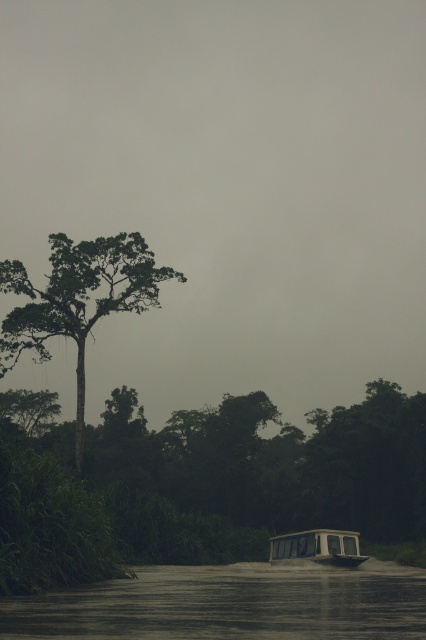
Question: Considering the relative positions of dark water at lower center and white plastic boat at lower center in the image provided, where is dark water at lower center located with respect to white plastic boat at lower center?

Choices:
 (A) above
 (B) below

Answer: (A)

Question: Which point appears closest to the camera in this image?

Choices:
 (A) (77, 596)
 (B) (333, 540)

Answer: (A)

Question: Which point is closer to the camera?

Choices:
 (A) green matte tree at upper left
 (B) dark water at lower center

Answer: (B)

Question: Does dark water at lower center have a larger size compared to white plastic boat at lower center?

Choices:
 (A) no
 (B) yes

Answer: (B)

Question: Does dark water at lower center have a lesser width compared to green matte tree at upper left?

Choices:
 (A) yes
 (B) no

Answer: (A)

Question: Which object is farther from the camera taking this photo?

Choices:
 (A) green matte tree at upper left
 (B) white plastic boat at lower center

Answer: (A)